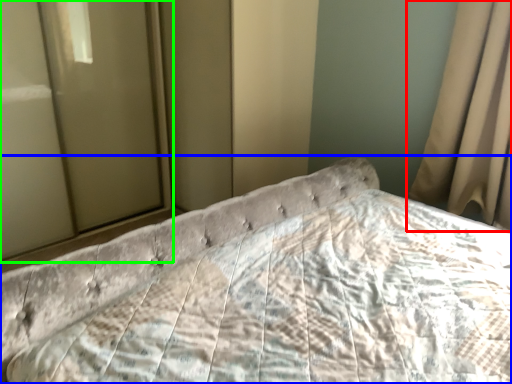
Question: Estimate the real-world distances between objects in this image. Which object is closer to curtain (highlighted by a red box), bed (highlighted by a blue box) or glass door (highlighted by a green box)?

Choices:
 (A) bed
 (B) glass door

Answer: (A)